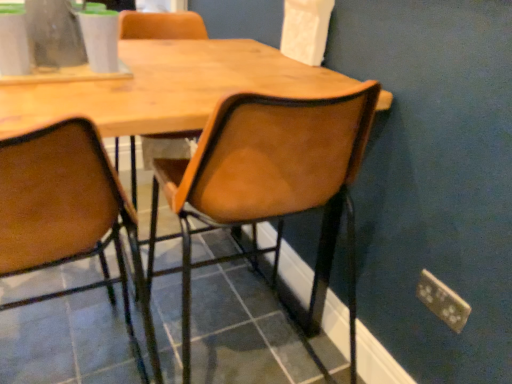
This screenshot has height=384, width=512. I want to click on free location to the right of clear glass vase at upper left, so click(x=145, y=76).